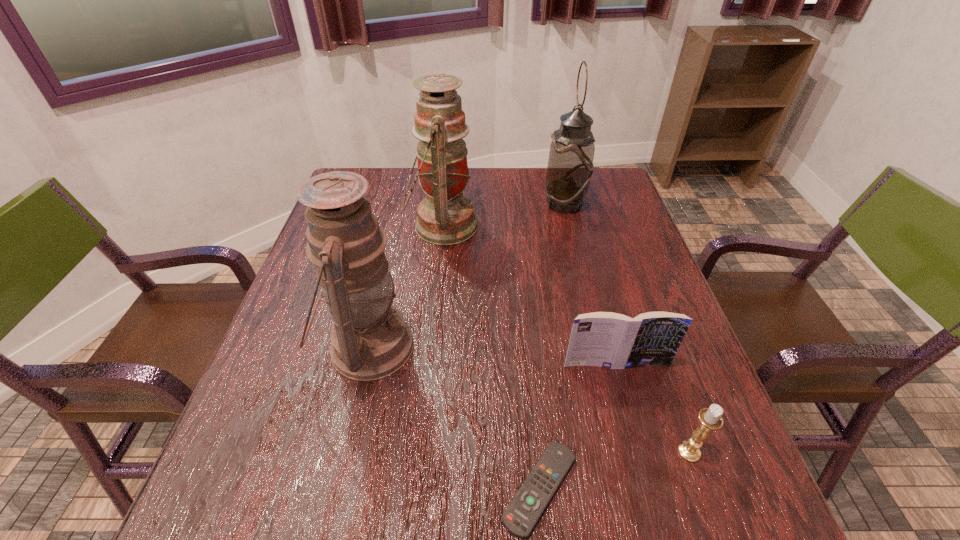
The image size is (960, 540). Identify the location of the rightmost oil lamp. (570, 167).

Locate an element on the screen. This screenshot has height=540, width=960. the nearest oil lamp is located at coordinates 370,340.

At what (x,y) coordinates should I click in order to perform the action: click on book. Please return your answer as a coordinate pair (x, y). This screenshot has width=960, height=540. Looking at the image, I should click on (606, 339).

Image resolution: width=960 pixels, height=540 pixels. What are the coordinates of `candle holder` in the screenshot? It's located at (710, 418).

Where is `remote control`? This screenshot has height=540, width=960. remote control is located at coordinates (522, 514).

The width and height of the screenshot is (960, 540). Find the location of `the third object from left to right`. the third object from left to right is located at coordinates (522, 514).

At what (x,y) coordinates should I click in order to perform the action: click on free location located 0.120m on the left of the rightmost oil lamp. Please return your answer as a coordinate pair (x, y). The image size is (960, 540). Looking at the image, I should click on (504, 204).

Where is `vacant area located 0.360m on the back of the nearest oil lamp`? The height and width of the screenshot is (540, 960). vacant area located 0.360m on the back of the nearest oil lamp is located at coordinates (398, 214).

This screenshot has height=540, width=960. I want to click on vacant space located on the front cover of the book, so pyautogui.click(x=631, y=419).

Locate an element on the screen. vacant space situated on the back of the candle holder is located at coordinates (639, 313).